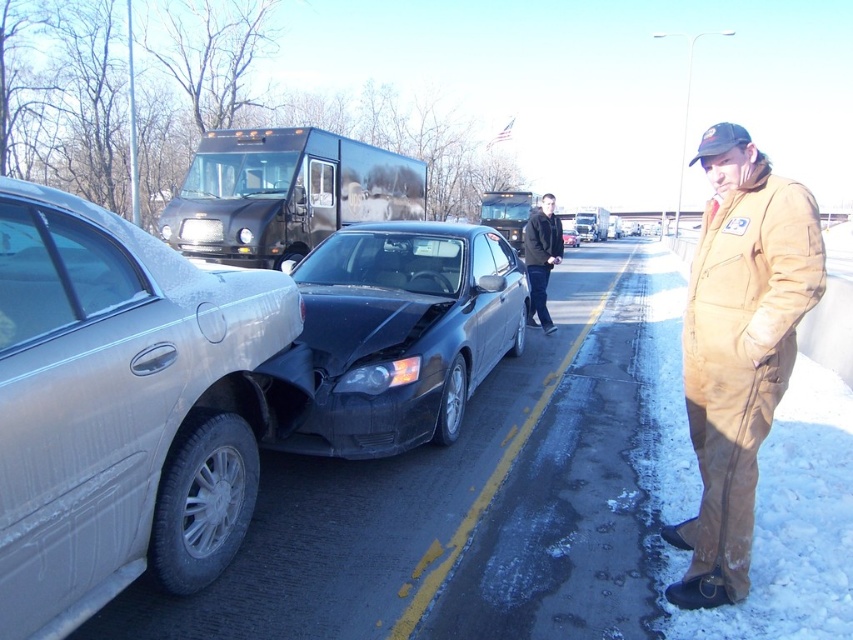
Based on the scene description and the coordinates provided, which object corresponds to the point at [120,406]?

The point at [120,406] corresponds to the satin silver sedan at left.

You are a traffic officer assessing the accident scene. You need to determine which vehicle or object takes up more area in the image. Based on the scene, which one is larger in size between the satin silver sedan at left and the brown corduroy jumpsuit at right?

The satin silver sedan at left occupies less space than brown corduroy jumpsuit at right, so the brown corduroy jumpsuit at right is larger in size.

You are standing at the scene of a car accident on a snowy road. You see two points marked in the image. The first point is at coordinates point (41, 625) and the second is at point (788, 188). From your perspective, which point is closer to you?

Point (41, 625) is in front of point (788, 188), so it is closer to you.